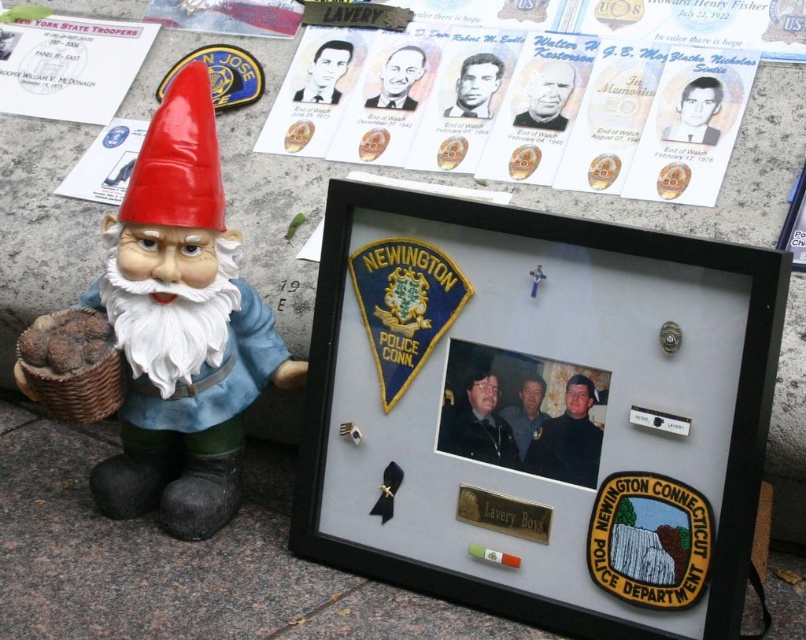
Question: In this image, where is matte black shadowbox at center located relative to matte paper portraits at upper center?

Choices:
 (A) above
 (B) below

Answer: (B)

Question: Is matte black shadowbox at center thinner than metallic silver plaque at center?

Choices:
 (A) no
 (B) yes

Answer: (A)

Question: Is matte plastic gnome at left to the right of metallic silver badge at center from the viewer's perspective?

Choices:
 (A) yes
 (B) no

Answer: (B)

Question: Which point appears farthest from the camera in this image?

Choices:
 (A) (613, 456)
 (B) (634, 410)
 (C) (406, 161)

Answer: (C)

Question: Which point appears closest to the camera in this image?

Choices:
 (A) (467, 512)
 (B) (730, 131)
 (C) (226, 506)

Answer: (A)

Question: Which point appears farthest from the camera in this image?

Choices:
 (A) (653, 156)
 (B) (532, 513)

Answer: (A)